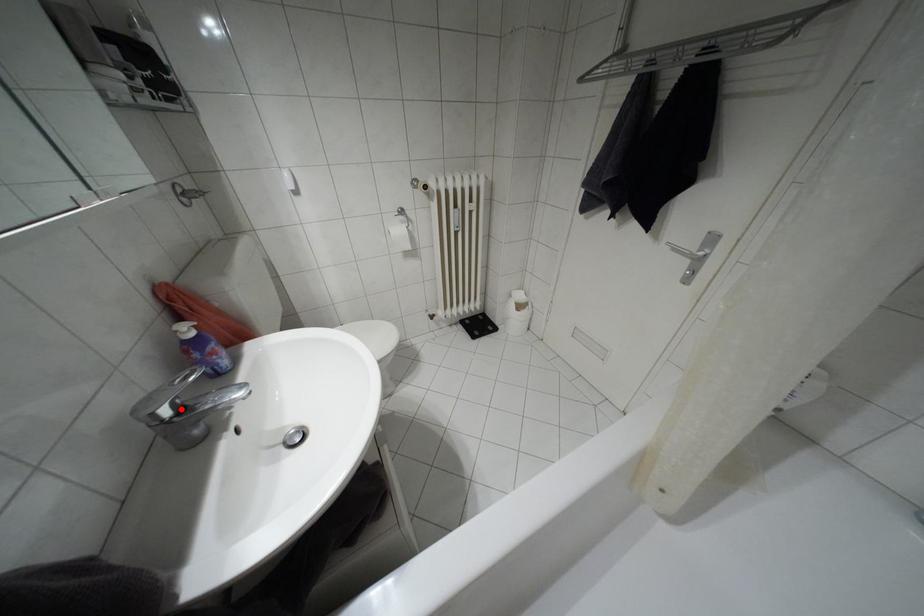
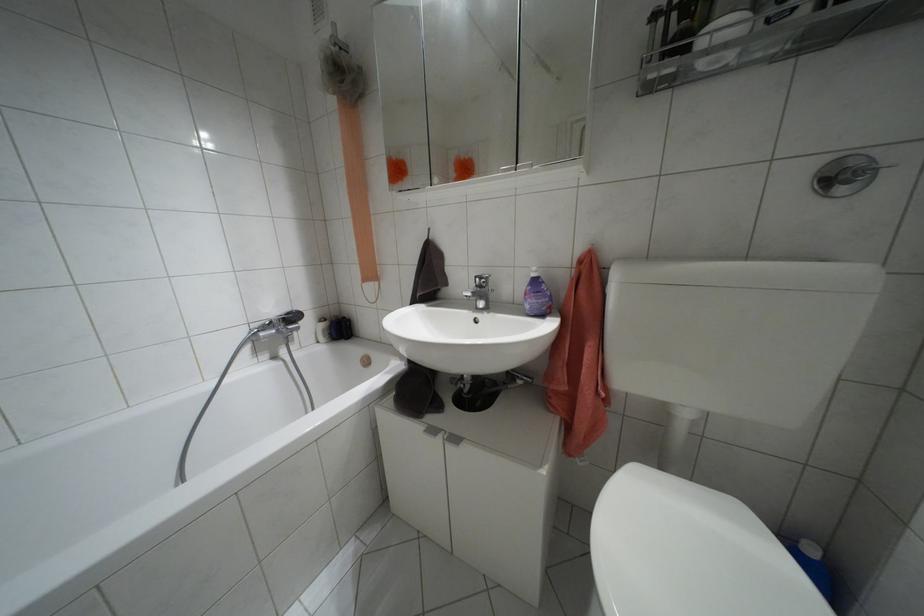
Find the pixel in the second image that matches the highlighted location in the first image.

(479, 286)